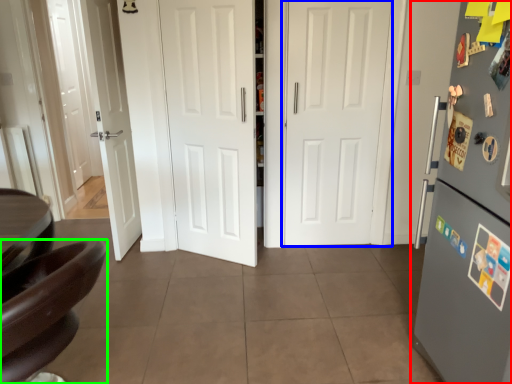
Question: Considering the real-world distances, which object is farthest from refrigerator (highlighted by a red box)? door (highlighted by a blue box) or chair (highlighted by a green box)?

Choices:
 (A) door
 (B) chair

Answer: (A)